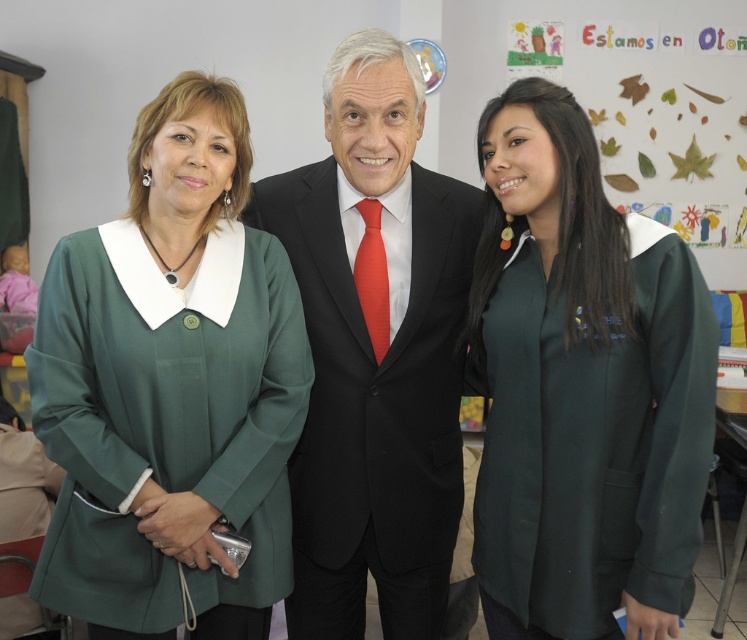
You are standing in a classroom and see three people. The first is a woman in a green coat with a white collar and black necklace on the left, the man in a black suit with a red tie in the center, and the woman in a dark green uniform with white accents on the right. There is a point marked at coordinates (170, 387). Which person is closest to this point?

The point marked at (170, 387) is closest to the green fabric coat at left, which belongs to the woman on the left wearing the green coat with a white collar and black necklace.

You are a photographer in a classroom setting. You notice the green fabric shirt at center and the green paper leaves at upper right. Which object is closer to you?

The green fabric shirt at center is closer to you because it is in front of the green paper leaves at upper right.

You are organizing a photo shoot and need to ensure that the green fabric shirt at center and the green paper leaves at upper right are visible in the frame. Which object should you adjust to make sure both are fully visible?

Since the green fabric shirt at center is thinner than the green paper leaves at upper right, you should adjust the camera angle or position to accommodate the wider width of the green paper leaves at upper right to ensure both objects are fully visible in the frame.